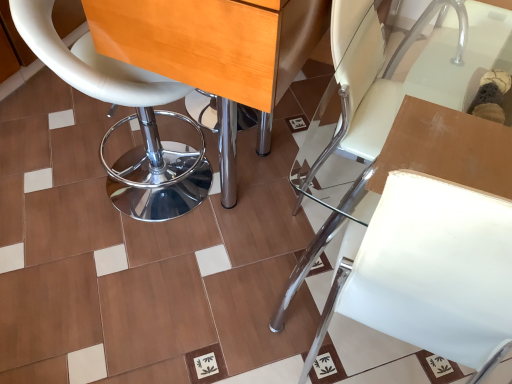
The image size is (512, 384). In order to click on free location to the left of wooden table at center in this screenshot , I will do `click(63, 163)`.